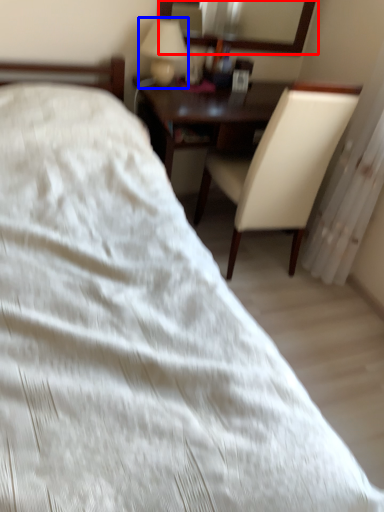
Question: Which object is closer to the camera taking this photo, mirror (highlighted by a red box) or table lamp (highlighted by a blue box)?

Choices:
 (A) mirror
 (B) table lamp

Answer: (B)